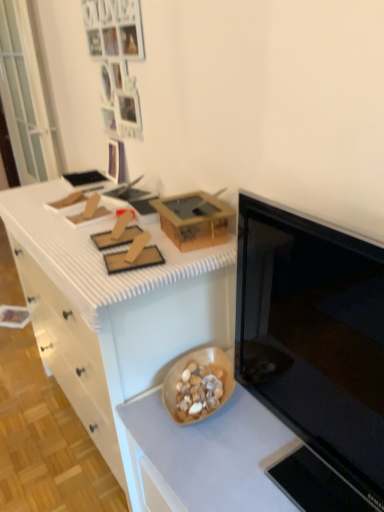
I want to click on free location in front of wooden bowl at lower center, so click(215, 453).